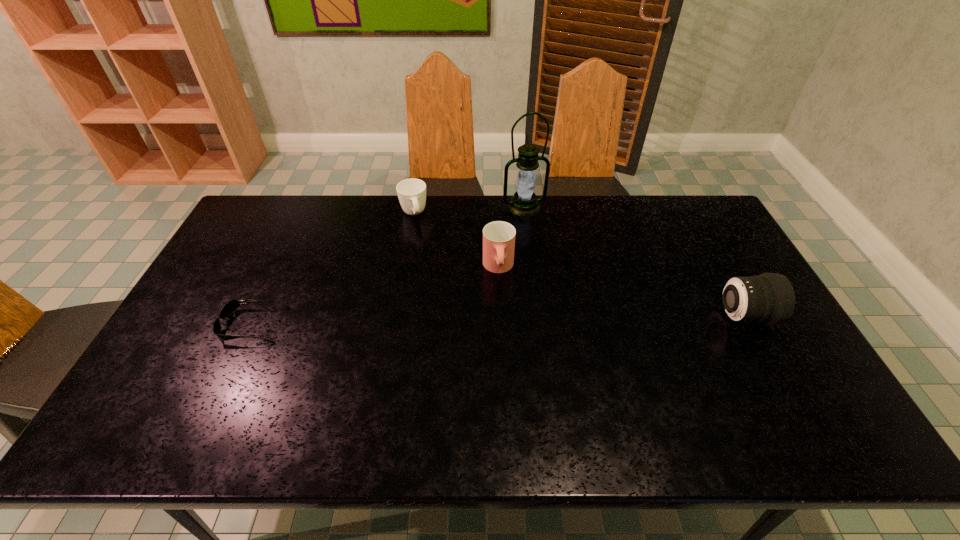
Where is `cup situated at the far edge`? This screenshot has height=540, width=960. cup situated at the far edge is located at coordinates (411, 192).

The image size is (960, 540). In order to click on object that is at the left edge in this screenshot , I will do `click(232, 305)`.

At what (x,y) coordinates should I click in order to perform the action: click on object present at the right edge. Please return your answer as a coordinate pair (x, y). Image resolution: width=960 pixels, height=540 pixels. Looking at the image, I should click on (769, 298).

In the image, there is a desktop. Identify the location of vacant space at the far edge. (319, 220).

This screenshot has width=960, height=540. In order to click on vacant region at the near edge in this screenshot , I will do `click(569, 374)`.

Where is `free space at the left edge`? free space at the left edge is located at coordinates (246, 288).

In the image, there is a desktop. At what (x,y) coordinates should I click in order to perform the action: click on vacant space at the right edge. Please return your answer as a coordinate pair (x, y). This screenshot has width=960, height=540. Looking at the image, I should click on (697, 239).

You are a GUI agent. You are given a task and a screenshot of the screen. Output one action in this format:
    pyautogui.click(x=<x>, y=<y>)
    Task: Click on the free space between the taller cup and the shortest object
    
    Given the screenshot: What is the action you would take?
    pyautogui.click(x=375, y=296)

You are a GUI agent. You are given a task and a screenshot of the screen. Output one action in this format:
    pyautogui.click(x=<x>, y=<y>)
    Task: Click on the empty space that is in between the sunglasses and the tallest object
    The height and width of the screenshot is (540, 960).
    Given the screenshot: What is the action you would take?
    point(389,266)

The height and width of the screenshot is (540, 960). In order to click on unoccupied position between the tallest object and the shorter cup in this screenshot , I will do `click(468, 211)`.